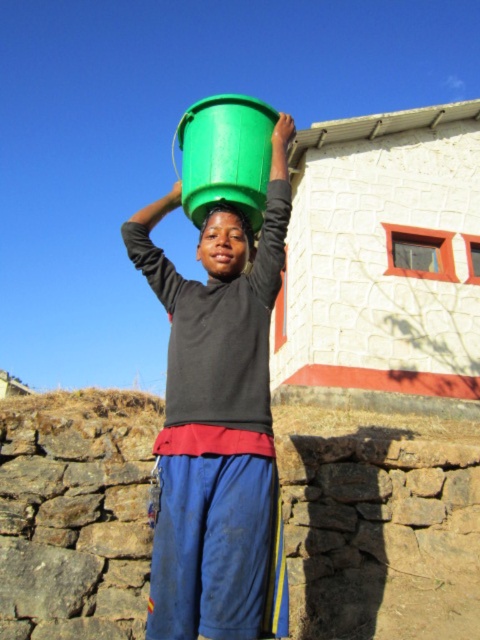
Locate an element on the screen. Image resolution: width=480 pixels, height=640 pixels. green plastic bucket at center is located at coordinates (218, 422).

Who is more distant from viewer, (201, 540) or (216, 260)?

Point (216, 260)

This screenshot has height=640, width=480. I want to click on green plastic bucket at center, so click(218, 422).